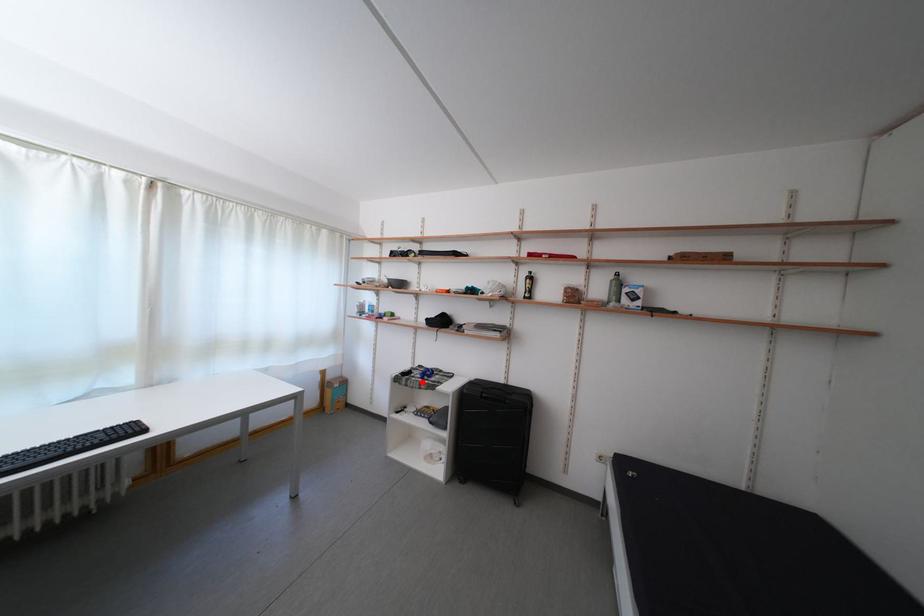
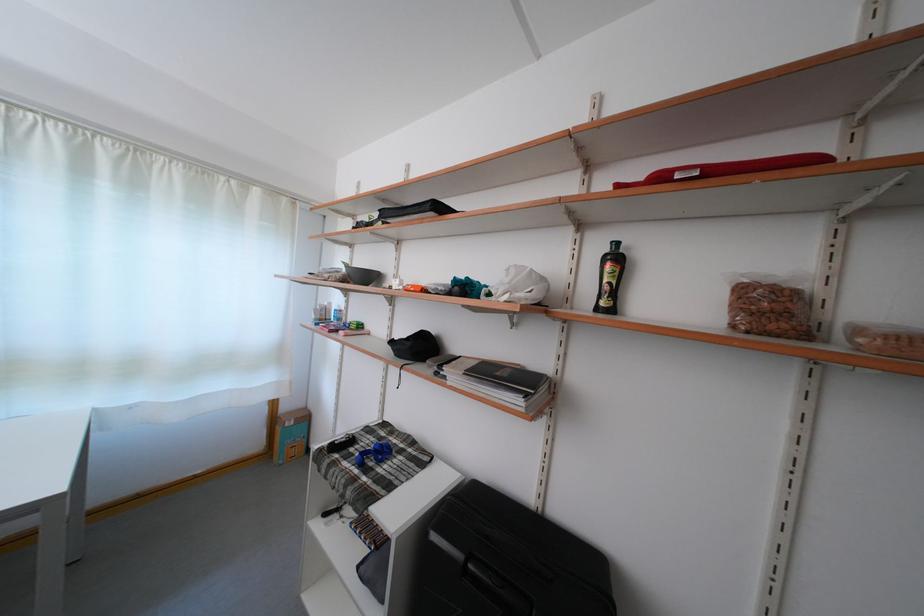
In the second image, find the point that corresponds to the highlighted location in the first image.

(358, 462)